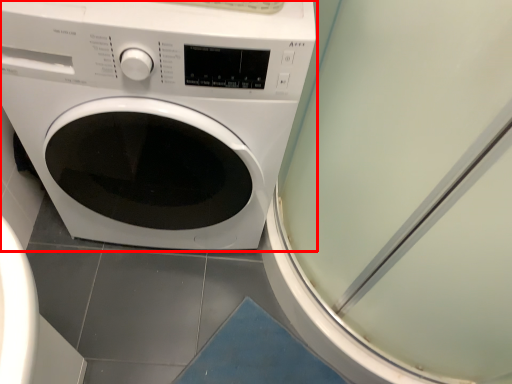
Question: Observing the image, what is the correct spatial positioning of washing machine (annotated by the red box) in reference to screen door?

Choices:
 (A) left
 (B) right

Answer: (A)